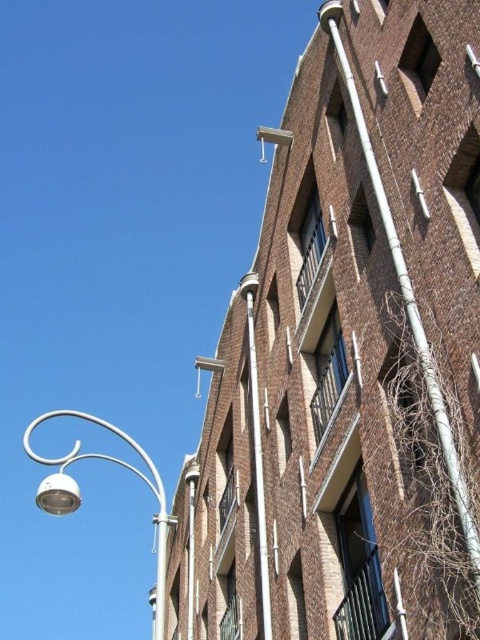
Consider the image. You are standing in front of a building and see a metallic silver streetlight at lower left and a metallic silver pole at center. Which object is closer to the ground?

The metallic silver streetlight at lower left is positioned under the metallic silver pole at center, meaning it is closer to the ground.

You are a delivery person trying to avoid hitting a metallic silver streetlight at lower left with your cart. The cart is 1.2 meters wide. There is a metallic pipe at upper center nearby. Can the cart pass between the two objects without touching them?

The metallic silver streetlight at lower left is bigger than the metallic pipe at upper center, but the description does not provide specific measurements of their sizes or the distance between them. Therefore, it is unclear if the cart can safely pass between them.

You are a maintenance worker standing at the base of the building. You need to reach both the metallic silver pole at center and the metallic pipe at upper center for inspection. Given that your ladder can extend up to 18 meters, can you safely reach both objects with a single ladder placement?

The distance between the metallic silver pole at center and the metallic pipe at upper center is 17.81 meters, so yes, the ladder can reach both objects since the distance is within its 18 meters extension limit.